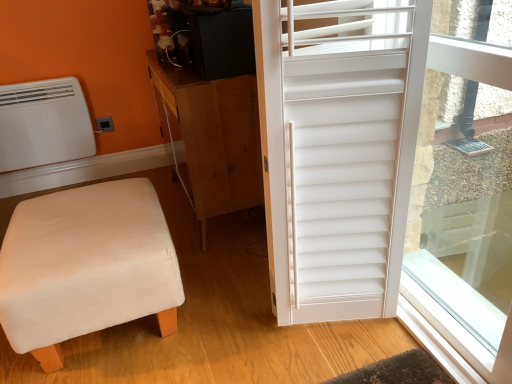
Question: Can you confirm if white matte air conditioner at upper left is bigger than white matte window screen at right?

Choices:
 (A) yes
 (B) no

Answer: (B)

Question: From a real-world perspective, is white matte air conditioner at upper left positioned under white matte window screen at right based on gravity?

Choices:
 (A) no
 (B) yes

Answer: (B)

Question: Considering the relative sizes of white matte air conditioner at upper left and white matte window screen at right in the image provided, is white matte air conditioner at upper left taller than white matte window screen at right?

Choices:
 (A) no
 (B) yes

Answer: (A)

Question: Considering the relative positions of white matte air conditioner at upper left and white matte window screen at right in the image provided, is white matte air conditioner at upper left to the left of white matte window screen at right from the viewer's perspective?

Choices:
 (A) no
 (B) yes

Answer: (B)

Question: Is there a large distance between white matte air conditioner at upper left and white matte window screen at right?

Choices:
 (A) no
 (B) yes

Answer: (B)

Question: Is point [x=98, y=226] closer or farther from the camera than point [x=33, y=129]?

Choices:
 (A) farther
 (B) closer

Answer: (B)

Question: Is beige fabric stool at lower left in front of or behind white matte air conditioner at upper left in the image?

Choices:
 (A) behind
 (B) front

Answer: (B)

Question: Is beige fabric stool at lower left wider or thinner than white matte air conditioner at upper left?

Choices:
 (A) wide
 (B) thin

Answer: (A)

Question: Choose the correct answer: Is beige fabric stool at lower left inside white matte air conditioner at upper left or outside it?

Choices:
 (A) inside
 (B) outside

Answer: (B)

Question: From the image's perspective, is white matte shutter at right above or below white matte air conditioner at upper left?

Choices:
 (A) above
 (B) below

Answer: (B)

Question: Looking at their shapes, would you say white matte shutter at right is wider or thinner than white matte air conditioner at upper left?

Choices:
 (A) wide
 (B) thin

Answer: (A)

Question: From a real-world perspective, is white matte shutter at right physically located above or below white matte air conditioner at upper left?

Choices:
 (A) below
 (B) above

Answer: (B)

Question: Considering the positions of point (309, 192) and point (16, 134), is point (309, 192) closer or farther from the camera than point (16, 134)?

Choices:
 (A) farther
 (B) closer

Answer: (B)

Question: Based on their sizes in the image, would you say white matte shutter at right is bigger or smaller than white matte window screen at right?

Choices:
 (A) small
 (B) big

Answer: (B)

Question: Is point (357, 311) positioned closer to the camera than point (467, 180)?

Choices:
 (A) closer
 (B) farther

Answer: (A)